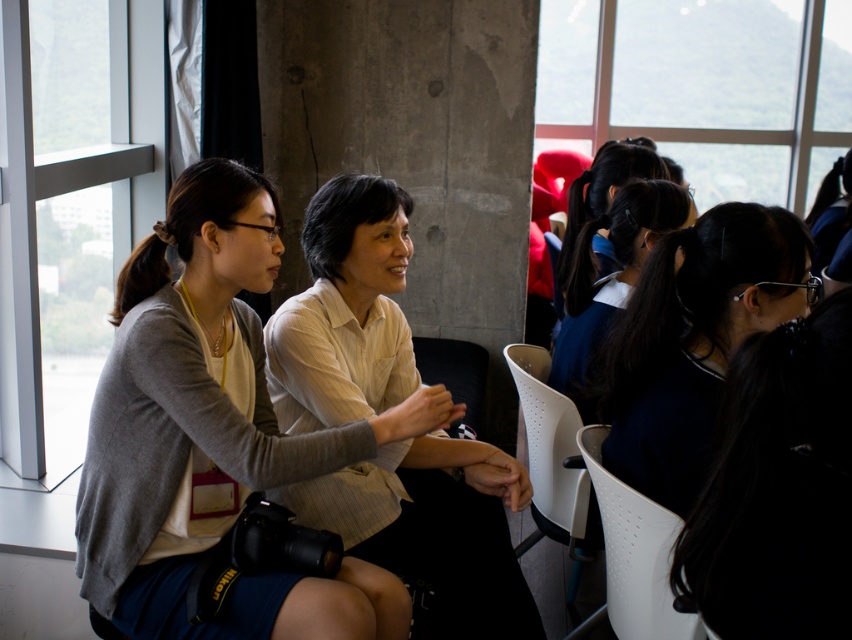
Between point (571, 227) and point (430, 356), which one is positioned in front?

Point (571, 227) is more forward.

What do you see at coordinates (600, 196) in the screenshot? I see `dark blue hair at center` at bounding box center [600, 196].

Identify the location of dark blue hair at center. The width and height of the screenshot is (852, 640). (600, 196).

The image size is (852, 640). Find the location of `white perforated plastic chair at center`. white perforated plastic chair at center is located at coordinates 548,480.

Which of these two, white perforated plastic chair at center or dark blue fabric hair tie at center, stands shorter?

dark blue fabric hair tie at center is shorter.

Where is `white perforated plastic chair at center`? This screenshot has height=640, width=852. white perforated plastic chair at center is located at coordinates (548, 480).

Can you confirm if white perforated chair at center is positioned below dark blue hair at center?

Correct, white perforated chair at center is located below dark blue hair at center.

Does white perforated chair at center appear on the right side of dark blue hair at center?

Incorrect, white perforated chair at center is not on the right side of dark blue hair at center.

Who is more forward, (626, 627) or (565, 237)?

Point (626, 627)

Find the location of a particular element. The image size is (852, 640). white perforated chair at center is located at coordinates (635, 554).